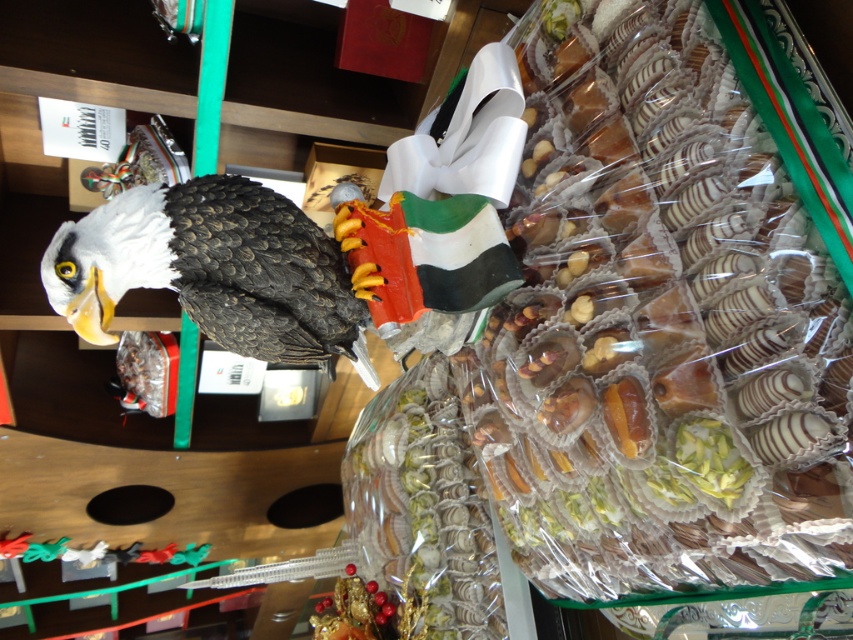
You are a customer in the shop holding a 12 inch ruler. You want to measure the distance between yourself and the translucent plastic confections at right. Can you reach the confections with your ruler?

The distance between the translucent plastic confections at right and the camera is 32.19 inches. Since the ruler is only 12 inches long, you cannot reach the confections with your ruler.

Consider the image. You are a customer in the shop and want to buy the shiny black eagle at left and the translucent plastic confections at right. The store has a rule that items must be placed in a box that can accommodate both items side by side. The box you have is 50 cm wide. Can both items fit in the box?

The translucent plastic confections at right has a lesser width compared to shiny black eagle at left. If the shiny black eagle at left is wider than the translucent plastic confections at right, but the combined width of both items must be less than or equal to 50 cm. However, without knowing the exact widths of each item, it is impossible to determine if they will fit together in the box.

You are a customer in a shop and see the shiny black eagle at left and the translucent plastic confections at right. Which item is positioned more to the right side of the image?

The translucent plastic confections at right are positioned more to the right side of the image than the shiny black eagle at left.